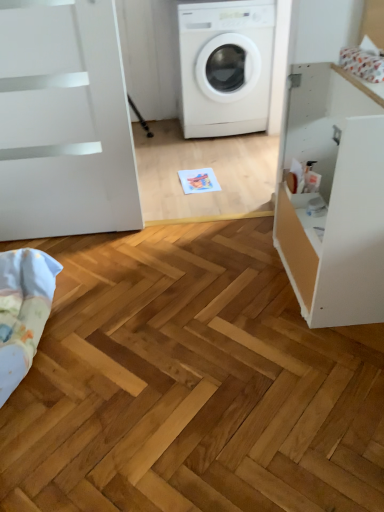
What do you see at coordinates (225, 66) in the screenshot?
I see `white matte washing machine at center` at bounding box center [225, 66].

You are a GUI agent. You are given a task and a screenshot of the screen. Output one action in this format:
    pyautogui.click(x=<x>, y=<y>)
    Task: Click on the white matte cabinet at right
    The image size is (384, 512).
    Given the screenshot: What is the action you would take?
    pyautogui.click(x=333, y=197)

Where is `white matte washing machine at center`? white matte washing machine at center is located at coordinates (225, 66).

Can you confirm if white matte washing machine at center is wider than white matte cabinet at right?

Yes.

Is white matte washing machine at center further to camera compared to white matte cabinet at right?

Yes, white matte washing machine at center is behind white matte cabinet at right.

In terms of height, does white matte washing machine at center look taller or shorter compared to white matte cabinet at right?

white matte washing machine at center is taller than white matte cabinet at right.

Is white matte washing machine at center positioned with its back to white matte cabinet at right?

That's not correct — white matte washing machine at center is not looking away from white matte cabinet at right.

Is point (37, 294) positioned after point (245, 101)?

No, (37, 294) is in front of (245, 101).

From a real-world perspective, which object stands above the other?

white matte washing machine at center.

Which of these two, light blue cotton blanket at lower left or white matte washing machine at center, is bigger?

With larger size is white matte washing machine at center.

The width and height of the screenshot is (384, 512). I want to click on bedding on the left of white matte washing machine at center, so click(x=23, y=311).

From the image's perspective, which one is positioned higher, white matte washing machine at center or light blue cotton blanket at lower left?

white matte washing machine at center appears higher in the image.

Is white matte washing machine at center directly adjacent to light blue cotton blanket at lower left?

There is a gap between white matte washing machine at center and light blue cotton blanket at lower left.

From a real-world perspective, is light blue cotton blanket at lower left on top of white matte cabinet at right?

No, from a real-world perspective, light blue cotton blanket at lower left is not over white matte cabinet at right

Is light blue cotton blanket at lower left facing away from white matte cabinet at right?

No, light blue cotton blanket at lower left is not facing away from white matte cabinet at right.

Is light blue cotton blanket at lower left not near white matte cabinet at right?

Indeed, light blue cotton blanket at lower left is not near white matte cabinet at right.

Is light blue cotton blanket at lower left taller or shorter than white matte cabinet at right?

Clearly, light blue cotton blanket at lower left is shorter compared to white matte cabinet at right.

Is white matte cabinet at right in front of or behind light blue cotton blanket at lower left in the image?

Clearly, white matte cabinet at right is in front of light blue cotton blanket at lower left.

Is white matte cabinet at right facing towards light blue cotton blanket at lower left?

Yes, white matte cabinet at right faces towards light blue cotton blanket at lower left.

Is white matte cabinet at right wider or thinner than light blue cotton blanket at lower left?

In the image, white matte cabinet at right appears to be wider than light blue cotton blanket at lower left.

Based on their sizes in the image, would you say white matte cabinet at right is bigger or smaller than light blue cotton blanket at lower left?

Considering their sizes, white matte cabinet at right takes up more space than light blue cotton blanket at lower left.

Which is nearer, (326, 213) or (254, 94)?

Point (326, 213) is positioned closer to the camera compared to point (254, 94).

Does white matte cabinet at right have a greater width compared to white matte washing machine at center?

In fact, white matte cabinet at right might be narrower than white matte washing machine at center.

From the image's perspective, which is above, white matte cabinet at right or white matte washing machine at center?

white matte washing machine at center is shown above in the image.

What are the coordinates of `file cabinet on the right of white matte washing machine at center` in the screenshot? It's located at (333, 197).

Find the location of a particular element. bedding to the left of white matte washing machine at center is located at coordinates (23, 311).

When comparing their distances from light blue cotton blanket at lower left, does white matte washing machine at center or white matte cabinet at right seem further?

Among the two, white matte washing machine at center is located further to light blue cotton blanket at lower left.

When comparing their distances from light blue cotton blanket at lower left, does white matte cabinet at right or white matte washing machine at center seem further?

white matte washing machine at center lies further to light blue cotton blanket at lower left than the other object.

Consider the image. When comparing their distances from white matte cabinet at right, does white matte washing machine at center or light blue cotton blanket at lower left seem further?

The object further to white matte cabinet at right is white matte washing machine at center.

Looking at this image, considering their positions, is white matte cabinet at right positioned further to white matte washing machine at center than light blue cotton blanket at lower left?

The object further to white matte washing machine at center is light blue cotton blanket at lower left.

Which object lies nearer to the anchor point white matte washing machine at center, light blue cotton blanket at lower left or white matte cabinet at right?

Among the two, white matte cabinet at right is located nearer to white matte washing machine at center.

Based on their spatial positions, is light blue cotton blanket at lower left or white matte washing machine at center closer to white matte cabinet at right?

Among the two, light blue cotton blanket at lower left is located nearer to white matte cabinet at right.

This screenshot has height=512, width=384. Find the location of `file cabinet that lies between white matte washing machine at center and light blue cotton blanket at lower left from top to bottom`. file cabinet that lies between white matte washing machine at center and light blue cotton blanket at lower left from top to bottom is located at coordinates tap(333, 197).